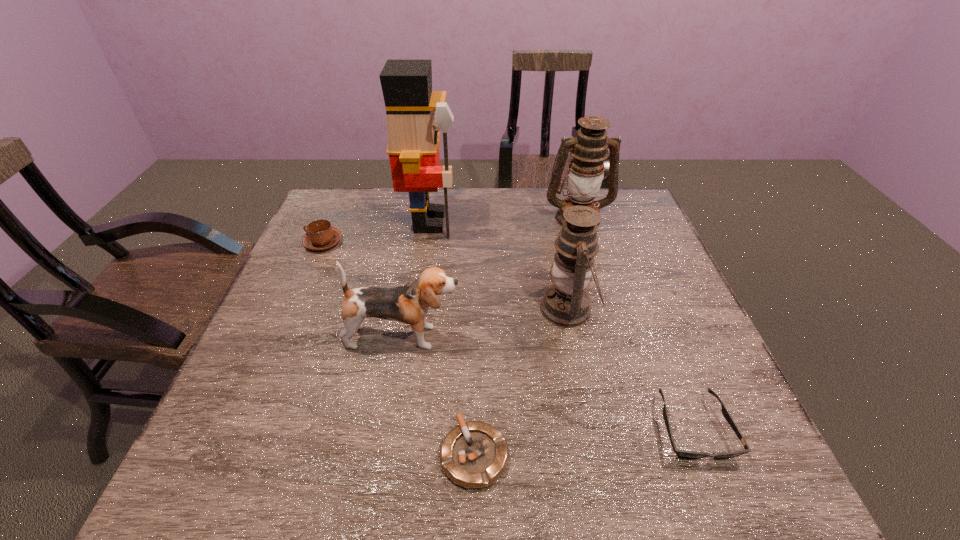
This screenshot has width=960, height=540. I want to click on nutcracker, so click(413, 126).

At what (x,y) coordinates should I click in order to perform the action: click on the farther oil lamp. Please return your answer as a coordinate pair (x, y). Looking at the image, I should click on (589, 149).

You are a GUI agent. You are given a task and a screenshot of the screen. Output one action in this format:
    pyautogui.click(x=<x>, y=<y>)
    Task: Click on the nearer oil lamp
    The image size is (960, 540).
    Given the screenshot: What is the action you would take?
    pyautogui.click(x=566, y=303)

You are a GUI agent. You are given a task and a screenshot of the screen. Output one action in this format:
    pyautogui.click(x=<x>, y=<y>)
    Task: Click on the fourth tallest object
    This screenshot has height=540, width=960.
    Given the screenshot: What is the action you would take?
    pyautogui.click(x=409, y=303)

You are a GUI agent. You are given a task and a screenshot of the screen. Output one action in this format:
    pyautogui.click(x=<x>, y=<y>)
    Task: Click on the leftmost object
    This screenshot has width=960, height=540.
    Given the screenshot: What is the action you would take?
    pyautogui.click(x=320, y=235)

Find the location of `the third shortest object`. the third shortest object is located at coordinates (320, 235).

This screenshot has width=960, height=540. What are the coordinates of `sunglasses` in the screenshot? It's located at (686, 454).

Locate an element on the screen. The image size is (960, 540). ashtray is located at coordinates (474, 454).

Where is `blank space located 0.400m in front of the nutcracker holding the staff`? The image size is (960, 540). blank space located 0.400m in front of the nutcracker holding the staff is located at coordinates (588, 221).

Where is `vacant space positioned 0.320m on the left of the farther oil lamp`? vacant space positioned 0.320m on the left of the farther oil lamp is located at coordinates (442, 218).